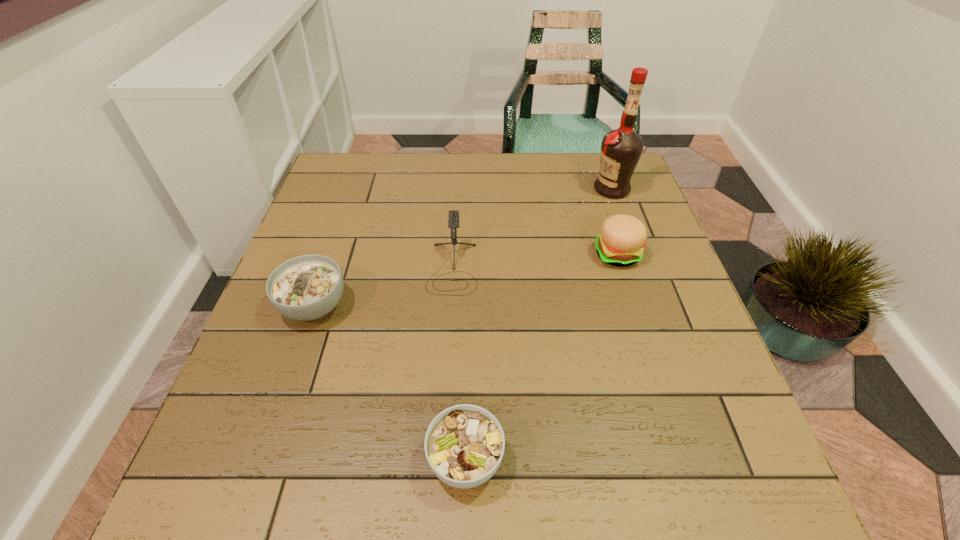
The width and height of the screenshot is (960, 540). What are the coordinates of `object present at the far right corner` in the screenshot? It's located at (621, 149).

Where is `free region at the far edge`? free region at the far edge is located at coordinates (441, 164).

The image size is (960, 540). I want to click on free space at the near edge of the desktop, so click(x=579, y=493).

Image resolution: width=960 pixels, height=540 pixels. What are the coordinates of `vacant area at the left edge` in the screenshot? It's located at (308, 246).

Identify the location of blank space at the right edge. The image size is (960, 540). (649, 294).

I want to click on vacant space at the near left corner, so click(x=220, y=494).

In the image, there is a desktop. Where is `vacant region at the far right corner`? The height and width of the screenshot is (540, 960). vacant region at the far right corner is located at coordinates pos(582,171).

At what (x,y) coordinates should I click in order to perform the action: click on vacant space at the near right corner. Please return your answer as a coordinate pair (x, y). The width and height of the screenshot is (960, 540). Looking at the image, I should click on (706, 471).

The image size is (960, 540). What are the coordinates of `unoccupied area between the nearer soup bowl and the microphone` in the screenshot? It's located at (459, 363).

The height and width of the screenshot is (540, 960). Identify the location of free area in between the microphone and the left soup bowl. (383, 287).